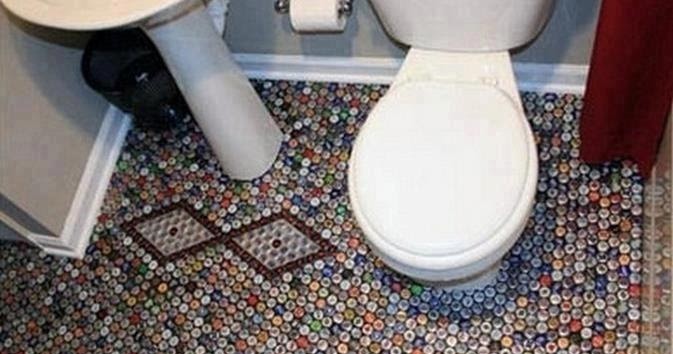
The image size is (673, 354). What are the coordinates of `doorframe` in the screenshot? It's located at (633, 69).